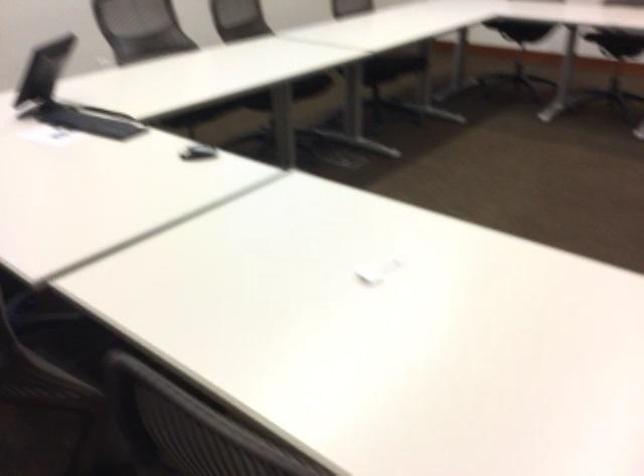
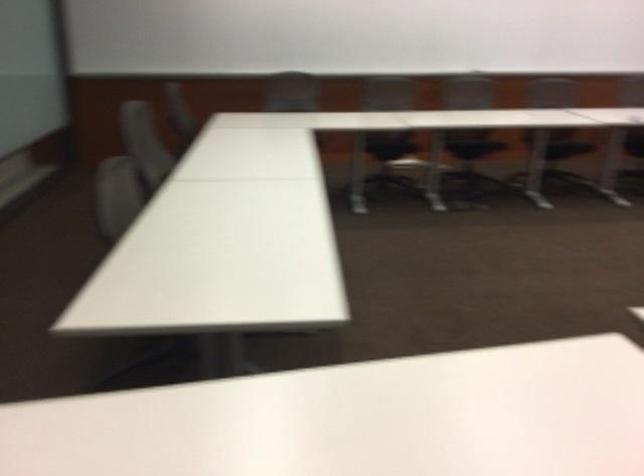
First-person continuous shooting, in which direction is the camera rotating?

The rotation direction of the camera is right-down.